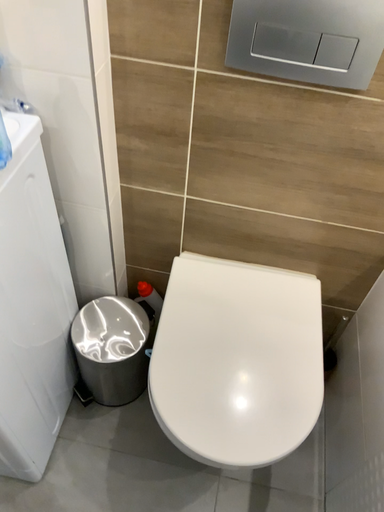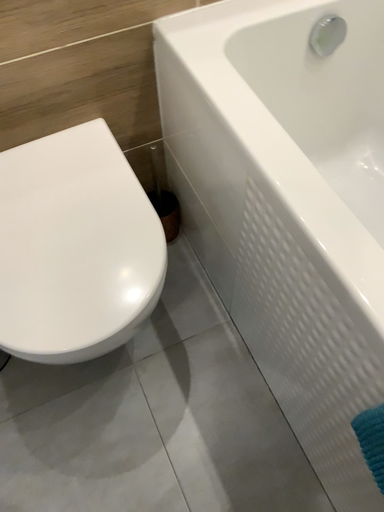
Question: Which way did the camera rotate in the video?

Choices:
 (A) rotated left
 (B) rotated right

Answer: (B)